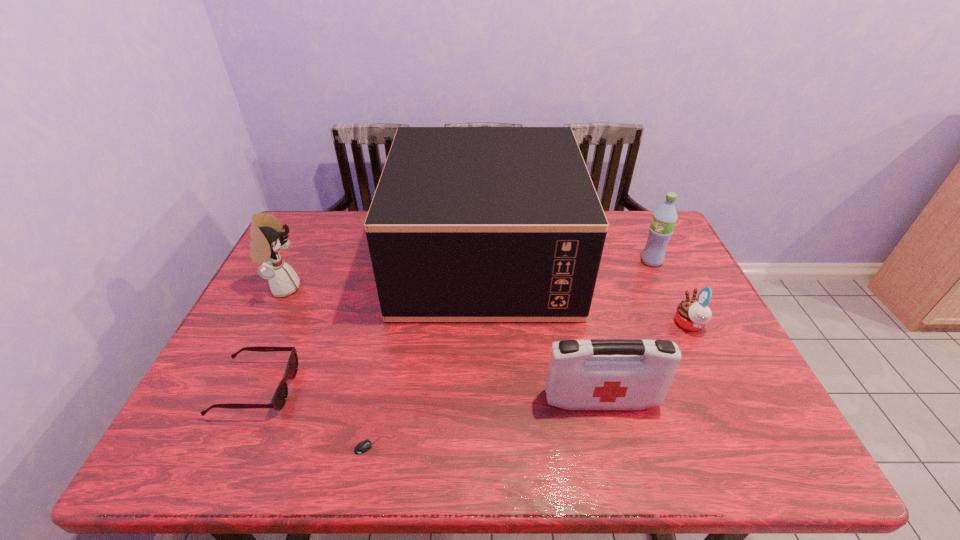
Where is `object at the near edge`? This screenshot has width=960, height=540. object at the near edge is located at coordinates (365, 445).

Identify the location of doll at the left edge. (267, 236).

Locate an element on the screen. The width and height of the screenshot is (960, 540). sunglasses present at the left edge is located at coordinates (279, 398).

Where is `water bottle that is at the right edge`? Image resolution: width=960 pixels, height=540 pixels. water bottle that is at the right edge is located at coordinates (664, 219).

The image size is (960, 540). Identify the location of muffin positioned at the right edge. (692, 314).

You are a GUI agent. You are given a task and a screenshot of the screen. Output one action in this format:
    pyautogui.click(x=<x>, y=<y>)
    Task: Click on the vacant space at the far edge of the desktop
    
    Given the screenshot: What is the action you would take?
    pyautogui.click(x=347, y=224)

Find the location of a particular element. The image size is (960, 540). free location at the near edge of the desktop is located at coordinates [x=578, y=466].

Where is `vacant space at the left edge of the desktop`? This screenshot has height=540, width=960. vacant space at the left edge of the desktop is located at coordinates (318, 283).

At what (x,y) coordinates should I click in order to perform the action: click on vacant space at the right edge of the desktop. Please return your answer as a coordinate pair (x, y). Looking at the image, I should click on (649, 291).

Image resolution: width=960 pixels, height=540 pixels. Find the location of `vacant space at the far right corner`. vacant space at the far right corner is located at coordinates (637, 231).